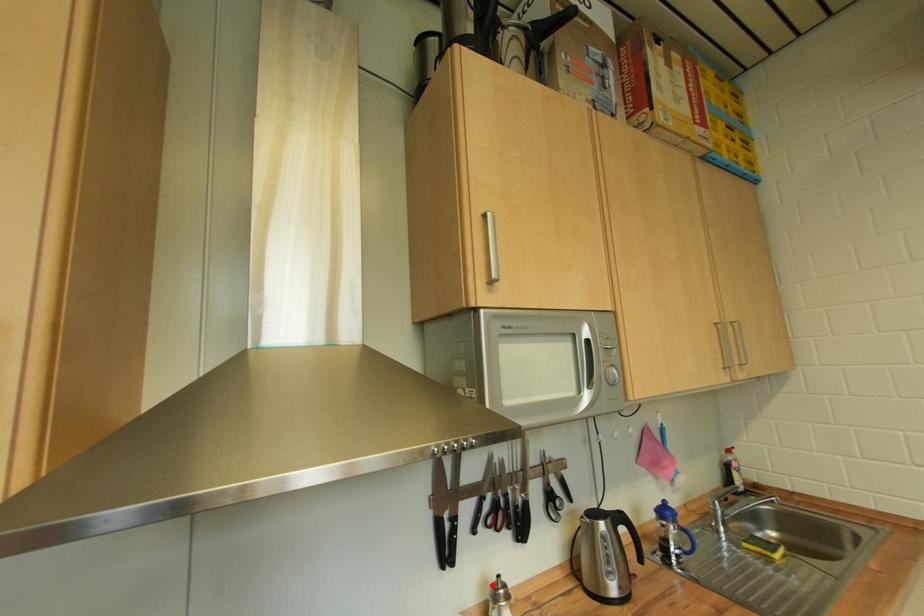
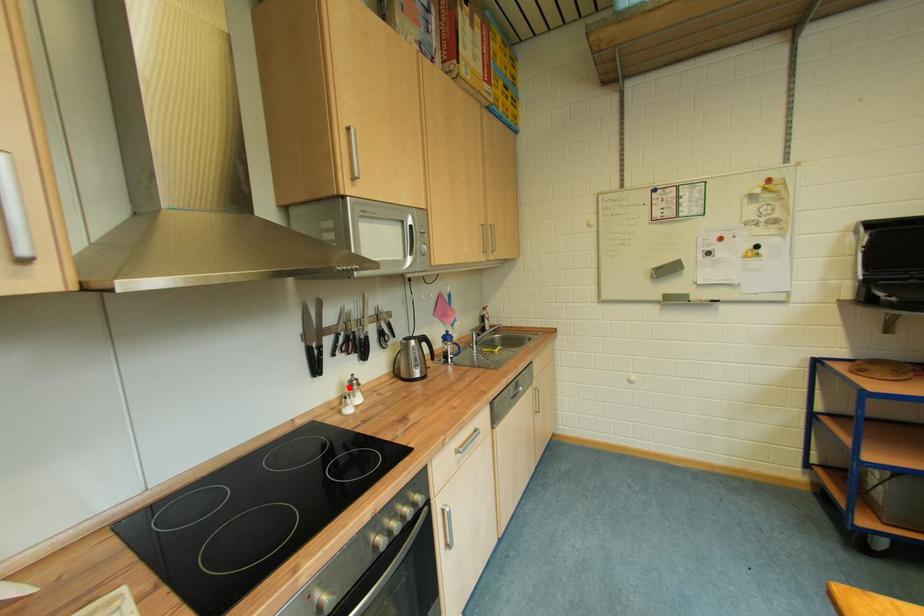
I am providing you with two images of the same scene from different viewpoints. A red point is marked on the first image and another point is marked on the second image. Is the red point in image1 aligned with the point shown in image2?

Yes